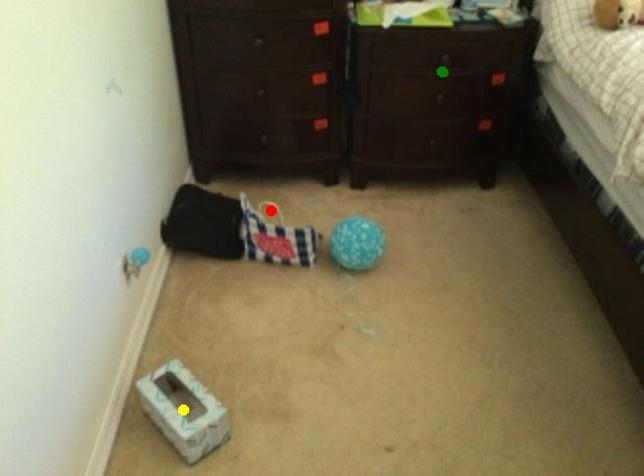
Order these from nearest to farthest:
yellow point | red point | green point

1. yellow point
2. green point
3. red point